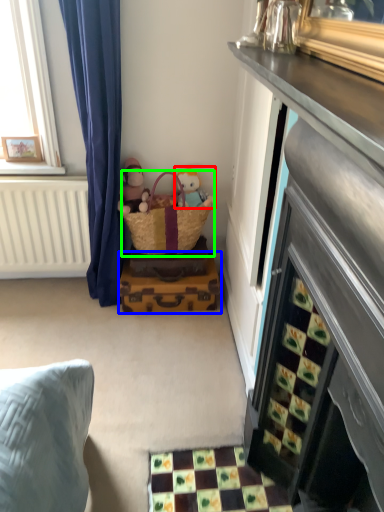
Question: Considering the real-world distances, which object is closest to toy (highlighted by a red box)? luggage (highlighted by a blue box) or picnic basket (highlighted by a green box).

Choices:
 (A) luggage
 (B) picnic basket

Answer: (B)